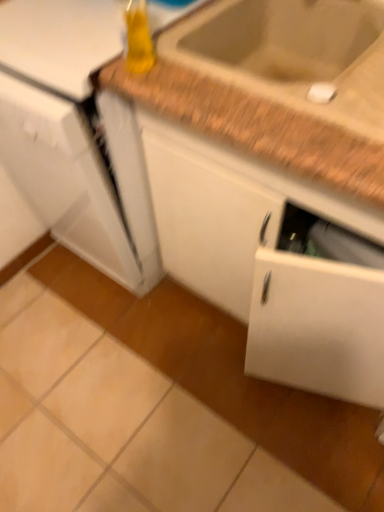
Question: Is brown speckled granite at upper right taller or shorter than translucent yellow bottle at upper center?

Choices:
 (A) short
 (B) tall

Answer: (B)

Question: From the image's perspective, relative to translucent yellow bottle at upper center, is brown speckled granite at upper right above or below?

Choices:
 (A) below
 (B) above

Answer: (A)

Question: Estimate the real-world distances between objects in this image. Which object is closer to the brown speckled granite at upper right?

Choices:
 (A) white glossy refrigerator at left
 (B) translucent yellow bottle at upper center
 (C) white matte cabinet at center

Answer: (B)

Question: Which is nearer to the translucent yellow bottle at upper center?

Choices:
 (A) brown speckled granite at upper right
 (B) white matte cabinet at center
 (C) white glossy refrigerator at left

Answer: (A)